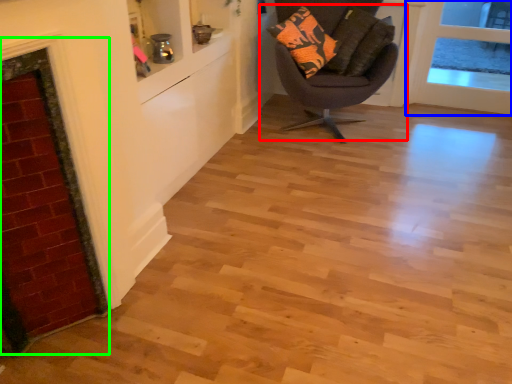
Question: Which object is the farthest from chair (highlighted by a red box)? Choose among these: door (highlighted by a blue box) or fireplace (highlighted by a green box).

Choices:
 (A) door
 (B) fireplace

Answer: (B)